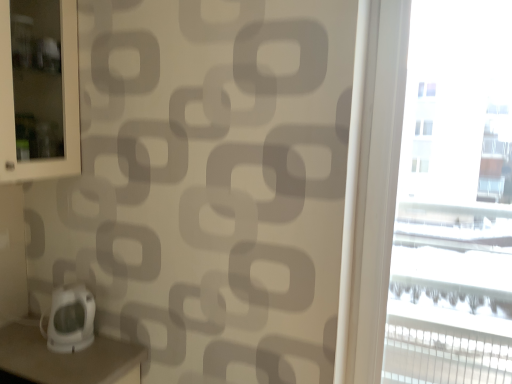
Question: Is transparent glass window at right inside the boundaries of white glossy scale at lower left, or outside?

Choices:
 (A) inside
 (B) outside

Answer: (B)

Question: Is point (504, 377) positioned closer to the camera than point (76, 347)?

Choices:
 (A) closer
 (B) farther

Answer: (B)

Question: From a real-world perspective, is transparent glass window at right physically located above or below white glossy scale at lower left?

Choices:
 (A) below
 (B) above

Answer: (B)

Question: Is point [79, 309] positioned closer to the camera than point [496, 329]?

Choices:
 (A) farther
 (B) closer

Answer: (B)

Question: From the image's perspective, is white glossy scale at lower left above or below transparent glass window at right?

Choices:
 (A) above
 (B) below

Answer: (B)

Question: Is white glossy scale at lower left in front of or behind transparent glass window at right in the image?

Choices:
 (A) front
 (B) behind

Answer: (B)

Question: From a real-world perspective, is white glossy scale at lower left positioned above or below transparent glass window at right?

Choices:
 (A) above
 (B) below

Answer: (B)